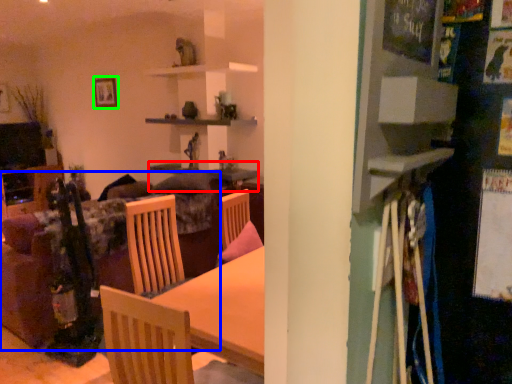
Question: Estimate the real-world distances between objects in this image. Which object is closer to table (highlighted by a red box), couch (highlighted by a blue box) or picture frame (highlighted by a green box)?

Choices:
 (A) couch
 (B) picture frame

Answer: (B)